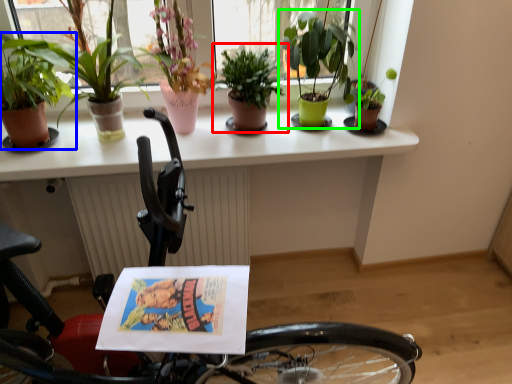
Question: Based on their relative distances, which object is farther from houseplant (highlighted by a red box)? Choose from houseplant (highlighted by a blue box) and houseplant (highlighted by a green box).

Choices:
 (A) houseplant
 (B) houseplant

Answer: (A)